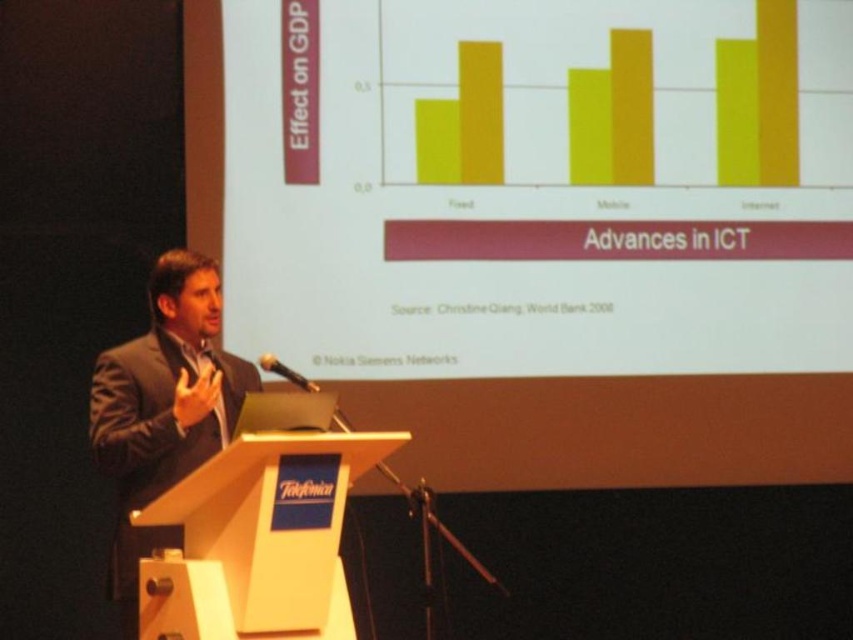
You are attending a presentation and want to move from your seat to the wooden podium at center. Which direction should you move relative to the dark suit at center?

The wooden podium at center is to the right of the dark suit at center, so you should move to the right relative to the dark suit at center to reach the wooden podium at center.